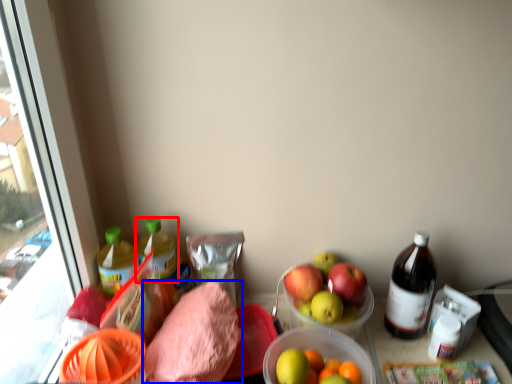
Question: Which point is further to the camera, bottle (highlighted by a red box) or waste (highlighted by a blue box)?

Choices:
 (A) bottle
 (B) waste

Answer: (A)